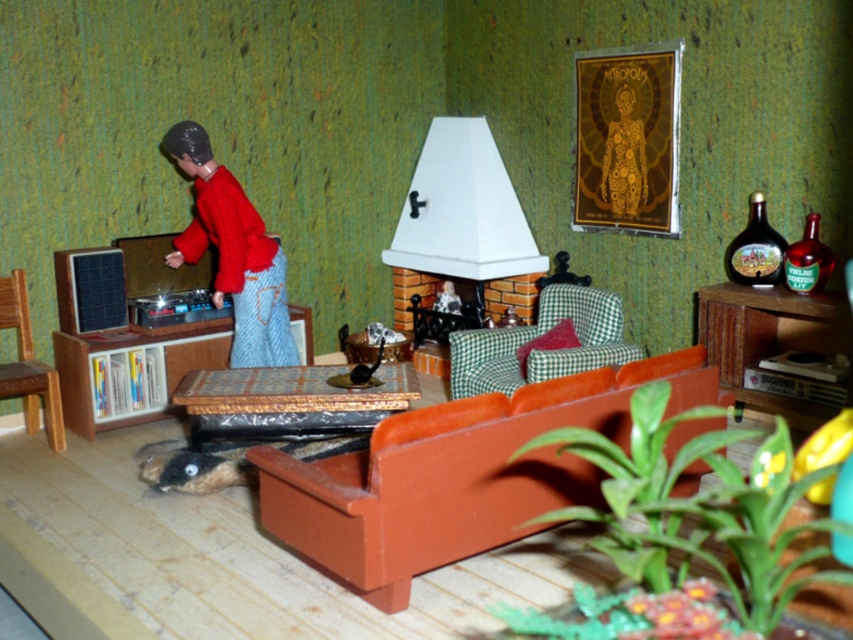
Question: Which object is farther from the camera taking this photo?

Choices:
 (A) brown wood cabinet at left
 (B) wooden chair at left

Answer: (A)

Question: Is the position of matte red sweater at left more distant than that of wooden coffee table at center?

Choices:
 (A) yes
 (B) no

Answer: (A)

Question: Which point is farther to the camera?

Choices:
 (A) (351, 470)
 (B) (746, 292)

Answer: (B)

Question: Which point is closer to the camera?

Choices:
 (A) wooden chair at left
 (B) wooden coffee table at center
 (C) matte orange couch at center

Answer: (C)

Question: Can you confirm if green checkered armchair at center is bigger than gold metallic figure at upper center?

Choices:
 (A) yes
 (B) no

Answer: (A)

Question: Can you confirm if wooden cabinet at right is wider than wooden chair at left?

Choices:
 (A) yes
 (B) no

Answer: (A)